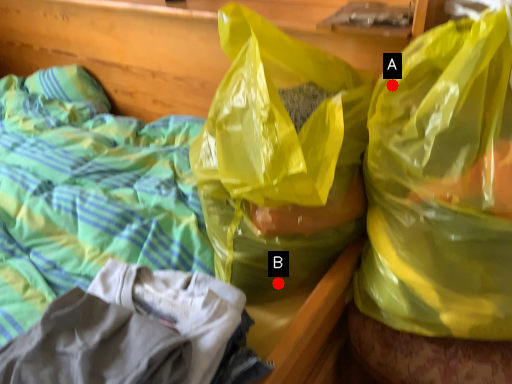
Question: Two points are circled on the image, labeled by A and B beside each circle. Which point appears farthest from the camera in this image?

Choices:
 (A) A is further
 (B) B is further

Answer: (B)